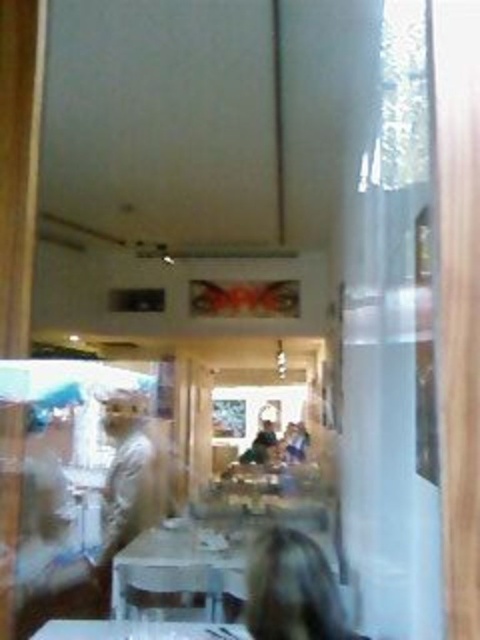
You are a delivery person trying to determine if a large pizza box that is 40 cm wide can fit on either the white glossy table at center or the white glossy table at lower center. Based on their widths, which table would be suitable?

The white glossy table at lower center has a greater width than the white glossy table at center. Since the pizza box is 40 cm wide, the white glossy table at lower center is wider and can accommodate the pizza box.

You are a delivery person standing outside the restaurant, and you need to place a large pizza box that is 1.2 meters long on one of the white glossy tables. Which table should you choose between the white glossy table at center and the white glossy table at lower center to ensure the pizza box fits without overhanging the edge?

The white glossy table at center is 1.12 meters away from the white glossy table at lower center. Since the pizza box is 1.2 meters long, it won let you place it on either table because the distance between them is shorter than the pizza box length. However, if the tables are separate and the question is about table length, but the description only provides distance between tables, the answer might need clarification. Wait, the problem states the pizza box is 1.2 meters long and asks which table to choose.